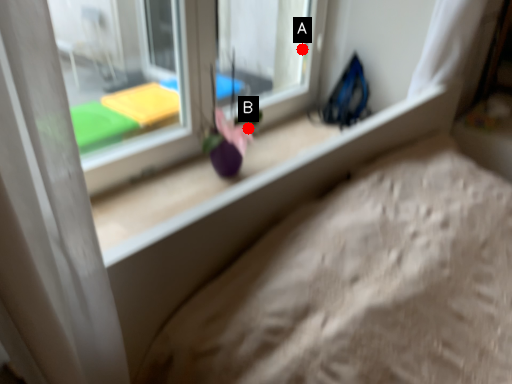
Question: Two points are circled on the image, labeled by A and B beside each circle. Which of the following is the farthest from the observer?

Choices:
 (A) A is further
 (B) B is further

Answer: (A)